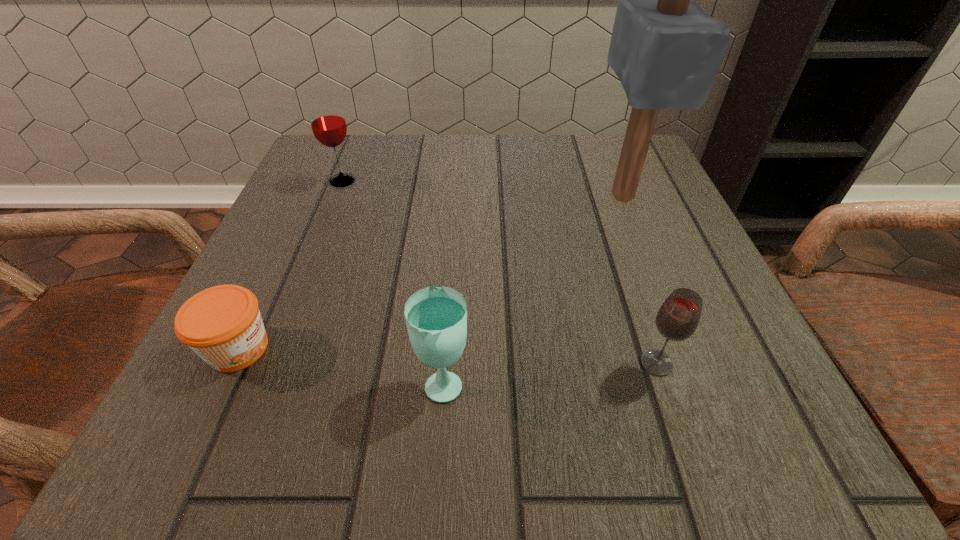
The height and width of the screenshot is (540, 960). Identify the location of unoccupied area between the mallet and the leftmost glass drink container. (482, 188).

Identify the location of free space between the second glass drink container from left to right and the farthest glass drink container. The width and height of the screenshot is (960, 540). (393, 281).

Locate an element on the screen. This screenshot has width=960, height=540. vacant space in between the farthest glass drink container and the rightmost glass drink container is located at coordinates (499, 272).

Where is `vacant space that's between the second glass drink container from left to right and the leftmost glass drink container`? vacant space that's between the second glass drink container from left to right and the leftmost glass drink container is located at coordinates (393, 281).

This screenshot has width=960, height=540. What are the coordinates of `free space between the leftmost glass drink container and the rightmost glass drink container` in the screenshot? It's located at (499, 272).

At what (x,y) coordinates should I click in order to perform the action: click on free area in between the third object from left to right and the mallet. Please return your answer as a coordinate pair (x, y). This screenshot has width=960, height=540. Looking at the image, I should click on (533, 288).

Locate which object is the third closest to the second glass drink container from left to right. Please provide its 2D coordinates. Your answer should be formatted as a tuple, i.e. [(x, y)], where the tuple contains the x and y coordinates of a point satisfying the conditions above.

[(666, 51)]

Locate an element on the screen. This screenshot has width=960, height=540. the second closest object to the third object from left to right is located at coordinates (677, 319).

Locate which glass drink container is the second closest to the third object from left to right. Please provide its 2D coordinates. Your answer should be formatted as a tuple, i.e. [(x, y)], where the tuple contains the x and y coordinates of a point satisfying the conditions above.

[(328, 124)]

Select which glass drink container appears as the closest to the shortest object. Please provide its 2D coordinates. Your answer should be formatted as a tuple, i.e. [(x, y)], where the tuple contains the x and y coordinates of a point satisfying the conditions above.

[(436, 317)]